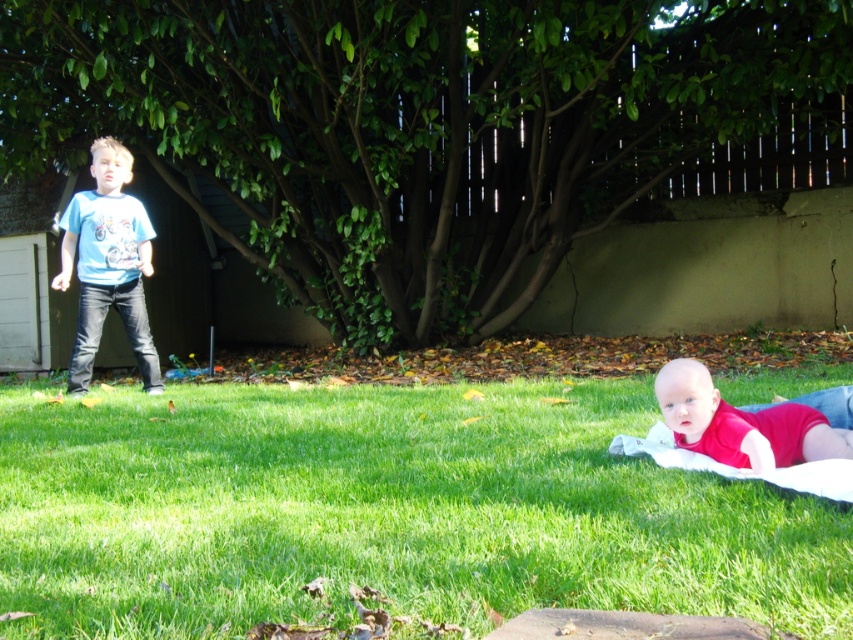
You are a drone operator trying to capture a photo of the baby on the blanket. The camera is positioned above the scene. To ensure both the green grass at lower center and the blue cotton shirt at left are visible in the frame, which object should be placed lower in the image?

The green grass at lower center should be placed lower in the image because it is located below the blue cotton shirt at left according to the description.

You are standing at point (148, 362) in the backyard scene. You want to take a photo of the baby on the blanket without getting too close. Since the camera is at a certain distance, can you estimate whether you are far enough to capture the baby in the frame?

The distance between point (148, 362) and the camera is 23.91 feet. Since this distance allows the camera to capture the entire scene including the baby on the blanket, you are far enough to take the photo without getting too close.

You are a photographer trying to capture a photo of the baby. You are standing behind the blue cotton shirt at left. Can you see the red smooth baby at lower right through the blue cotton shirt?

The red smooth baby at lower right is behind the blue cotton shirt at left, so the photographer cannot see the baby through the shirt as it is blocking the view.